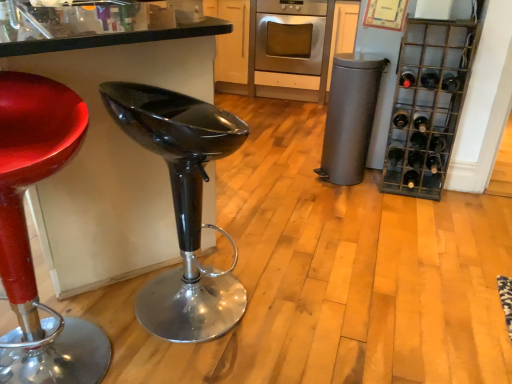
Find the location of a particular element. free spot to the left of black glass wine bottle at lower right, the tenth wine bottle when ordered from top to bottom is located at coordinates (389, 183).